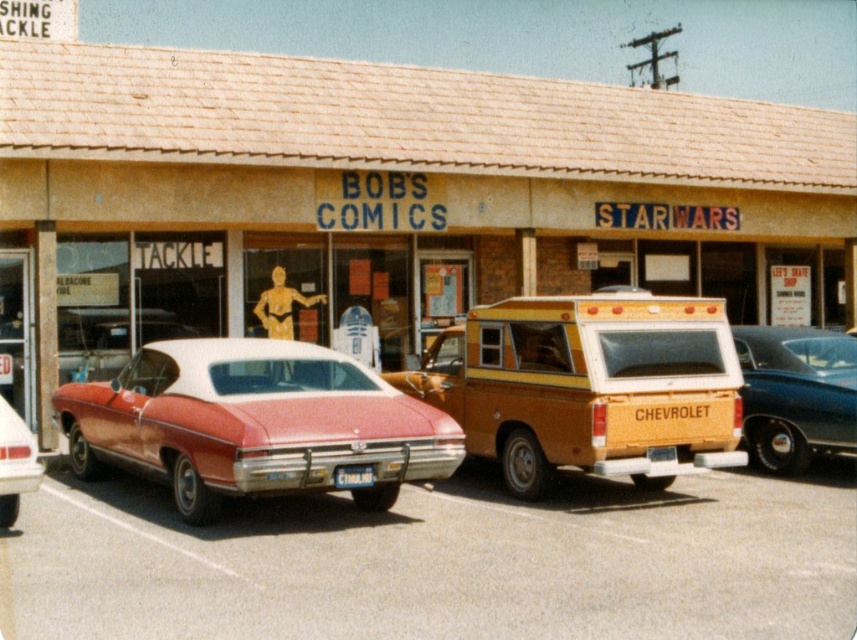
Which of these two, matte yellow truck at center or matte red car at center, stands shorter?

With less height is matte red car at center.

Describe the element at coordinates (382, 200) in the screenshot. I see `matte yellow truck at center` at that location.

You are a GUI agent. You are given a task and a screenshot of the screen. Output one action in this format:
    pyautogui.click(x=<x>, y=<y>)
    Task: Click on the matte yellow truck at center
    Image resolution: width=857 pixels, height=640 pixels.
    Given the screenshot: What is the action you would take?
    pyautogui.click(x=382, y=200)

What do you see at coordinates (382, 200) in the screenshot? Image resolution: width=857 pixels, height=640 pixels. I see `matte yellow truck at center` at bounding box center [382, 200].

Describe the element at coordinates (382, 200) in the screenshot. I see `matte yellow truck at center` at that location.

Image resolution: width=857 pixels, height=640 pixels. Identify the location of matte yellow truck at center. (382, 200).

Does shiny blue sedan at right have a greater height compared to white plastic license plate at center?

Indeed, shiny blue sedan at right has a greater height compared to white plastic license plate at center.

Is shiny blue sedan at right to the left of white plastic license plate at center from the viewer's perspective?

No, shiny blue sedan at right is not to the left of white plastic license plate at center.

Where is `shiny blue sedan at right`? The width and height of the screenshot is (857, 640). shiny blue sedan at right is located at coordinates (796, 394).